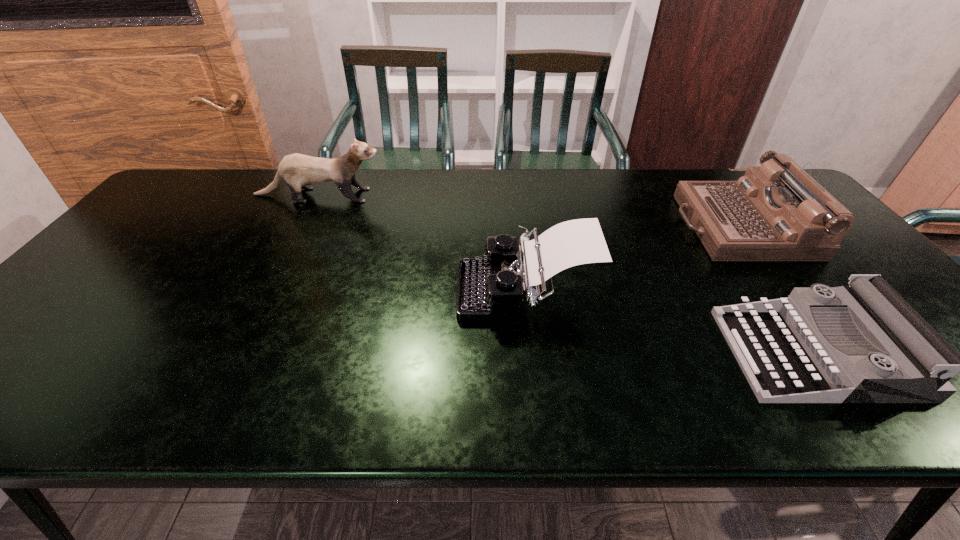
This screenshot has width=960, height=540. I want to click on ferret situated at the far edge, so click(x=297, y=170).

You are a GUI agent. You are given a task and a screenshot of the screen. Output one action in this format:
    pyautogui.click(x=<x>, y=<y>)
    Task: Click on the typewriter that is at the far edge
    The height and width of the screenshot is (540, 960).
    Given the screenshot: What is the action you would take?
    pyautogui.click(x=776, y=212)

This screenshot has height=540, width=960. Identify the location of object that is at the near edge. (786, 358).

The width and height of the screenshot is (960, 540). In order to click on object located in the far right corner section of the desktop in this screenshot , I will do `click(776, 212)`.

Where is `object that is at the near right corner`? The width and height of the screenshot is (960, 540). object that is at the near right corner is located at coordinates (786, 358).

You are a GUI agent. You are given a task and a screenshot of the screen. Output one action in this format:
    pyautogui.click(x=<x>, y=<y>)
    Task: Click on the free space at the far edge of the desktop
    This screenshot has width=960, height=540.
    Given the screenshot: What is the action you would take?
    pyautogui.click(x=680, y=171)

The height and width of the screenshot is (540, 960). I want to click on free space at the near edge of the desktop, so click(x=164, y=389).

You are a GUI agent. You are given a task and a screenshot of the screen. Output one action in this format:
    pyautogui.click(x=<x>, y=<y>)
    Task: Click on the free space at the right edge
    Image resolution: width=960 pixels, height=540 pixels.
    Given the screenshot: What is the action you would take?
    pyautogui.click(x=856, y=266)

What are the coordinates of `vacant space at the far left corner of the desktop` in the screenshot? It's located at (211, 196).

This screenshot has height=540, width=960. In order to click on free spot between the shortest typewriter and the ferret in this screenshot , I will do `click(567, 274)`.